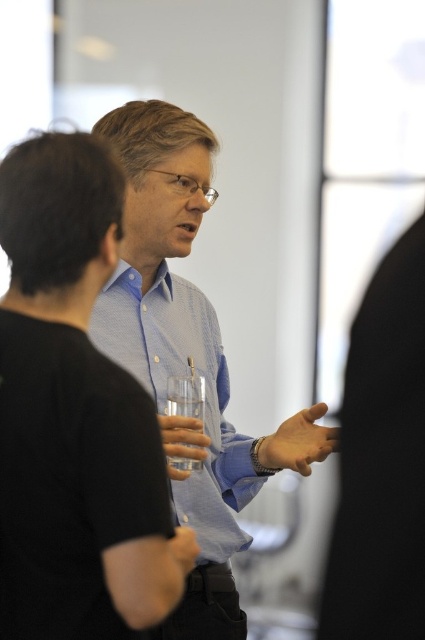
Does smooth skin hand at center have a lesser height compared to matte black hand at center?

In fact, smooth skin hand at center may be taller than matte black hand at center.

Between smooth skin hand at center and matte black hand at center, which one appears on the left side from the viewer's perspective?

Positioned to the left is matte black hand at center.

This screenshot has width=425, height=640. I want to click on smooth skin hand at center, so click(x=299, y=442).

What do you see at coordinates (178, 342) in the screenshot? I see `blue woven shirt at center` at bounding box center [178, 342].

Can you confirm if blue woven shirt at center is smaller than smooth skin hand at center?

Incorrect, blue woven shirt at center is not smaller in size than smooth skin hand at center.

Is point (161, 305) farther from viewer compared to point (292, 464)?

Yes, it is.

Where is `blue woven shirt at center`? blue woven shirt at center is located at coordinates (178, 342).

Is clear plastic glass at center to the left of clear glass at center from the viewer's perspective?

Incorrect, clear plastic glass at center is not on the left side of clear glass at center.

Who is more distant from viewer, (x=197, y=445) or (x=175, y=400)?

Positioned behind is point (x=197, y=445).

This screenshot has width=425, height=640. Find the location of `clear plastic glass at center`. clear plastic glass at center is located at coordinates (183, 444).